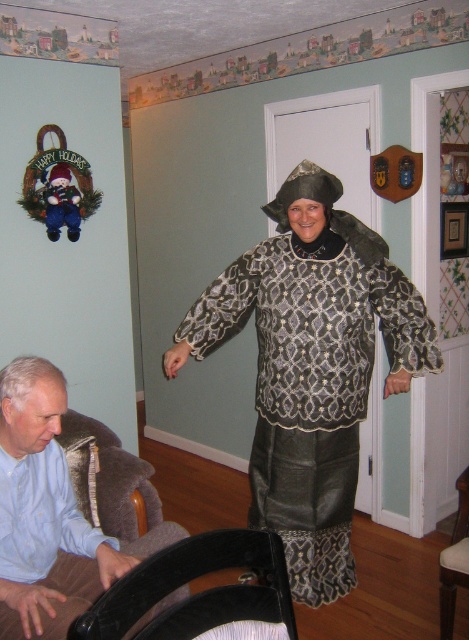
Question: Can you confirm if light blue shirt at lower left is bigger than brown fabric armchair at lower left?

Choices:
 (A) no
 (B) yes

Answer: (B)

Question: Which point appears farthest from the camera in this image?

Choices:
 (A) (449, 593)
 (B) (239, 548)
 (C) (43, 609)

Answer: (A)

Question: Which object appears closest to the camera in this image?

Choices:
 (A) matte black dress at center
 (B) brown fabric armchair at lower left

Answer: (B)

Question: Can you confirm if matte black dress at center is wider than brown fabric armchair at lower left?

Choices:
 (A) no
 (B) yes

Answer: (B)

Question: Is matte black dress at center to the right of black leather armchair at lower left from the viewer's perspective?

Choices:
 (A) no
 (B) yes

Answer: (B)

Question: Which point is farther to the camera?

Choices:
 (A) (45, 604)
 (B) (173, 618)

Answer: (A)